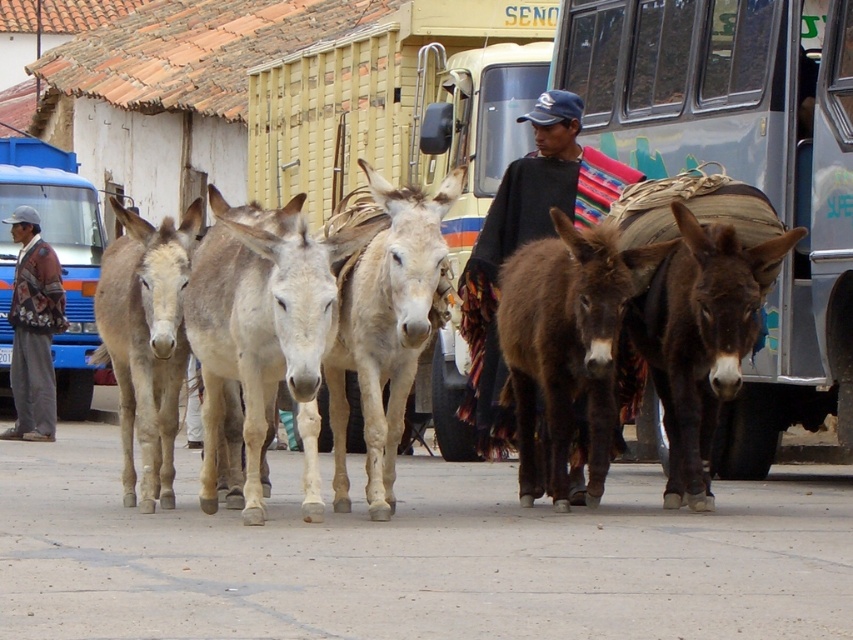
You are a tourist standing at the center of the street. You see a point marked at coordinate (566, 344). What object is located at that point?

The point at coordinate (566, 344) marks the brown fuzzy mule at center.